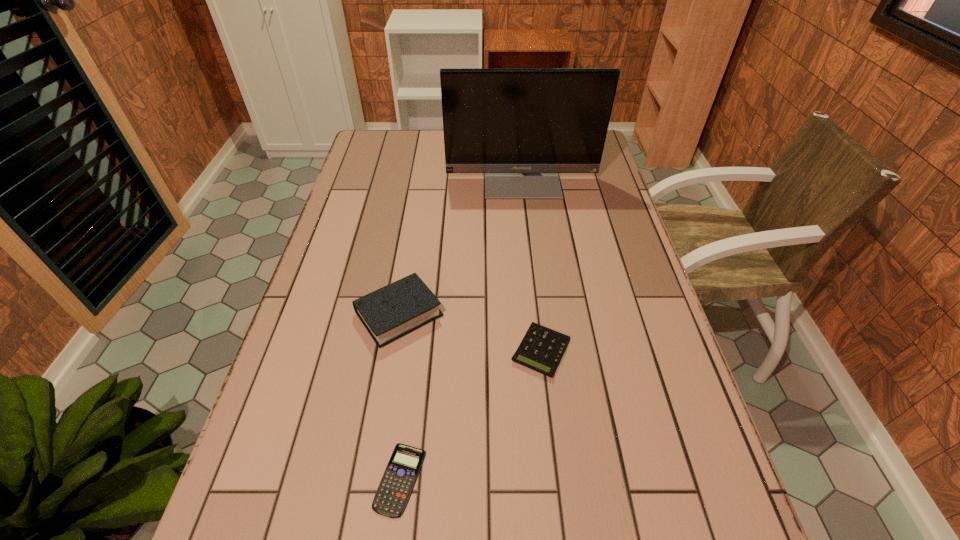
At what (x,y) coordinates should I click in order to perform the action: click on blank region between the Bible and the second shortest object. Please return your answer as a coordinate pair (x, y). The height and width of the screenshot is (540, 960). Looking at the image, I should click on (470, 332).

At what (x,y) coordinates should I click in order to perform the action: click on vacant area between the farthest object and the second tallest object. Please return your answer as a coordinate pair (x, y). The image size is (960, 540). Looking at the image, I should click on [x=461, y=246].

Locate an element on the screen. vacant region between the farther calculator and the nearest object is located at coordinates (470, 415).

The height and width of the screenshot is (540, 960). Identify the location of free space between the shortest object and the Bible. (399, 396).

Find the location of `vacant space that's between the shortest object and the tallest object`. vacant space that's between the shortest object and the tallest object is located at coordinates (461, 328).

This screenshot has width=960, height=540. Find the location of `free space between the shorter calculator and the farther calculator`. free space between the shorter calculator and the farther calculator is located at coordinates (470, 415).

At what (x,y) coordinates should I click in order to perform the action: click on unoccupied position between the third shortest object and the shorter calculator. Please return your answer as a coordinate pair (x, y). The image size is (960, 540). Looking at the image, I should click on (399, 396).

Identify the location of object that is the closest to the computer monitor. Image resolution: width=960 pixels, height=540 pixels. (397, 309).

Find the location of `the second closest object relative to the right calculator`. the second closest object relative to the right calculator is located at coordinates (395, 488).

At what (x,y) coordinates should I click in order to perform the action: click on free spot that satisfies the following two spatial constraints: 1. on the back side of the left calculator; 2. on the left side of the second shortest object. Please return your answer as a coordinate pair (x, y). Looking at the image, I should click on (416, 350).